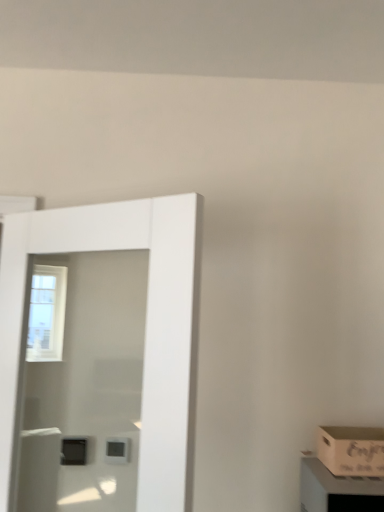
Question: Can you confirm if white glossy door at left is positioned to the right of wooden crate at lower right?

Choices:
 (A) yes
 (B) no

Answer: (B)

Question: From a real-world perspective, does white glossy door at left stand above wooden crate at lower right?

Choices:
 (A) no
 (B) yes

Answer: (B)

Question: Is white glossy door at left in front of wooden crate at lower right?

Choices:
 (A) yes
 (B) no

Answer: (A)

Question: From the image's perspective, is white glossy door at left on wooden crate at lower right?

Choices:
 (A) no
 (B) yes

Answer: (B)

Question: From the image's perspective, does white glossy door at left appear lower than wooden crate at lower right?

Choices:
 (A) no
 (B) yes

Answer: (A)

Question: Considering the positions of white glossy door at left and wooden crate at lower right in the image, is white glossy door at left bigger or smaller than wooden crate at lower right?

Choices:
 (A) small
 (B) big

Answer: (B)

Question: In terms of height, does white glossy door at left look taller or shorter compared to wooden crate at lower right?

Choices:
 (A) tall
 (B) short

Answer: (A)

Question: Considering their positions, is white glossy door at left located in front of or behind wooden crate at lower right?

Choices:
 (A) behind
 (B) front

Answer: (B)

Question: From a real-world perspective, is white glossy door at left above or below wooden crate at lower right?

Choices:
 (A) below
 (B) above

Answer: (B)

Question: Looking at their shapes, would you say wooden box at lower right is wider or thinner than white glossy door at left?

Choices:
 (A) wide
 (B) thin

Answer: (A)

Question: Is wooden box at lower right spatially inside white glossy door at left, or outside of it?

Choices:
 (A) inside
 (B) outside

Answer: (B)

Question: Considering the positions of wooden box at lower right and white glossy door at left in the image, is wooden box at lower right taller or shorter than white glossy door at left?

Choices:
 (A) short
 (B) tall

Answer: (A)

Question: From the image's perspective, relative to white glossy door at left, is wooden box at lower right above or below?

Choices:
 (A) above
 (B) below

Answer: (B)

Question: Looking at the image, does wooden crate at lower right seem bigger or smaller compared to wooden box at lower right?

Choices:
 (A) big
 (B) small

Answer: (A)

Question: From a real-world perspective, is wooden crate at lower right positioned above or below wooden box at lower right?

Choices:
 (A) below
 (B) above

Answer: (A)